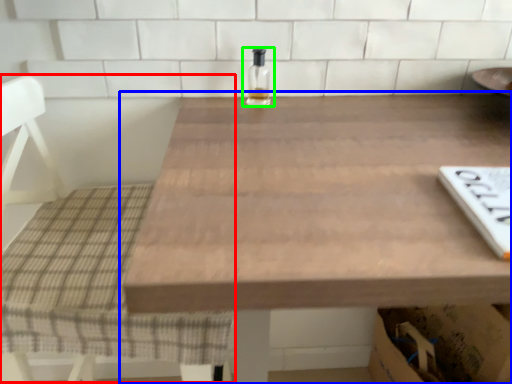
Question: Based on their relative distances, which object is nearer to chair (highlighted by a red box)? Choose from table (highlighted by a blue box) and bottle (highlighted by a green box).

Choices:
 (A) table
 (B) bottle

Answer: (A)